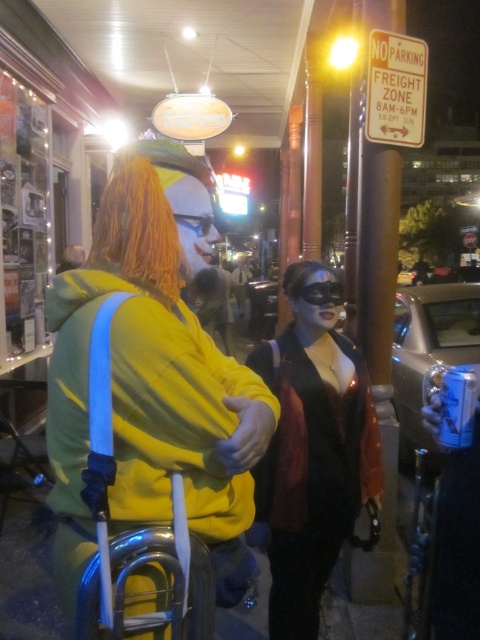
Who is positioned more to the left, yellow matte hoodie at center or orange synthetic wig at center?

From the viewer's perspective, orange synthetic wig at center appears more on the left side.

Is point (175, 456) farther from camera compared to point (176, 232)?

No, (175, 456) is in front of (176, 232).

Image resolution: width=480 pixels, height=640 pixels. What are the coordinates of `yellow matte hoodie at center` in the screenshot? It's located at (147, 410).

Consider the image. Between yellow matte hoodie at center and leather jacket at center, which one appears on the left side from the viewer's perspective?

yellow matte hoodie at center

How distant is yellow matte hoodie at center from leather jacket at center?

The distance of yellow matte hoodie at center from leather jacket at center is 21.56 inches.

Measure the distance between yellow matte hoodie at center and camera.

yellow matte hoodie at center is 3.56 feet from camera.

Locate an element on the screen. The width and height of the screenshot is (480, 640). yellow matte hoodie at center is located at coordinates (147, 410).

Which is more to the right, leather jacket at center or orange synthetic wig at center?

Positioned to the right is leather jacket at center.

Is the position of leather jacket at center less distant than that of orange synthetic wig at center?

No.

Locate an element on the screen. This screenshot has height=640, width=480. leather jacket at center is located at coordinates (312, 476).